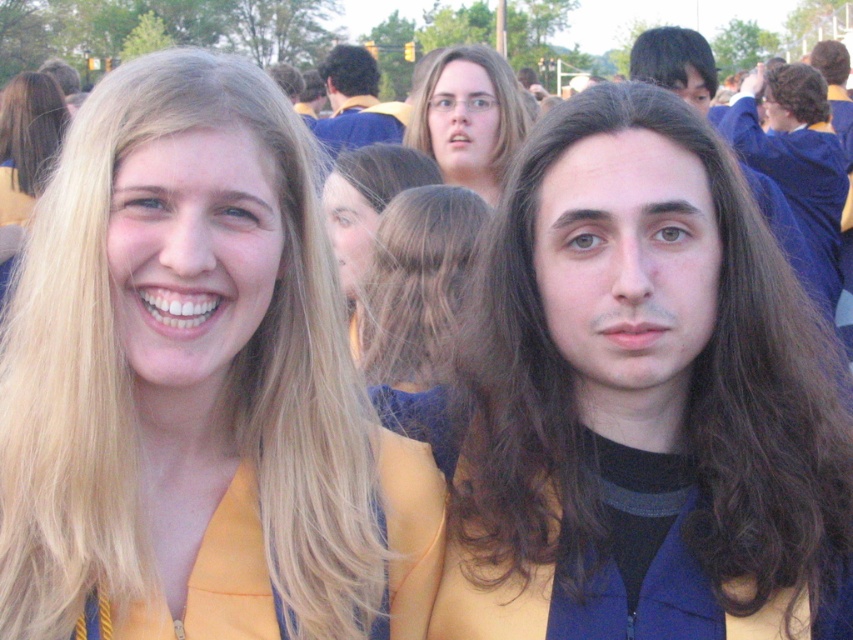
Can you confirm if dark brown silky hair at center is positioned below blonde silky hair at upper left?

Yes.

Find the location of `dark brown silky hair at center`. dark brown silky hair at center is located at coordinates (643, 378).

What do you see at coordinates (643, 378) in the screenshot? I see `dark brown silky hair at center` at bounding box center [643, 378].

Where is `dark brown silky hair at center`? The image size is (853, 640). dark brown silky hair at center is located at coordinates (643, 378).

Is matte yellow graduation gown at center below blonde hair at upper center?

Indeed, matte yellow graduation gown at center is positioned under blonde hair at upper center.

Is matte yellow graduation gown at center smaller than blonde hair at upper center?

Yes.

At what (x,y) coordinates should I click in order to perform the action: click on matte yellow graduation gown at center. Please return your answer as a coordinate pair (x, y). Image resolution: width=853 pixels, height=640 pixels. Looking at the image, I should click on (196, 387).

What are the coordinates of `matte yellow graduation gown at center` in the screenshot? It's located at pyautogui.click(x=196, y=387).

In the scene shown: Who is more forward, (723, 358) or (679, 76)?

Point (723, 358)

Is point (547, 118) in front of point (670, 40)?

Yes, point (547, 118) is in front of point (670, 40).

This screenshot has width=853, height=640. In order to click on dark brown silky hair at center in this screenshot , I will do `click(643, 378)`.